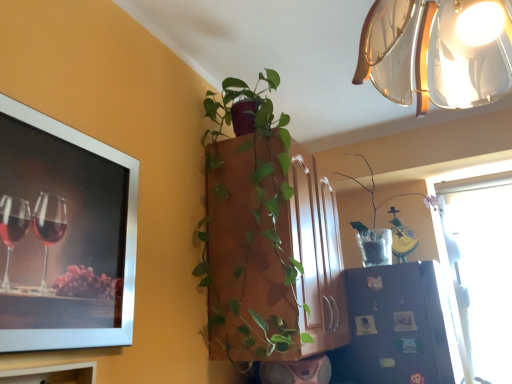
Describe the element at coordinates (387, 215) in the screenshot. The image size is (512, 384). I see `translucent glass vase at upper right, which is counted as the first houseplant, starting from the back` at that location.

What do you see at coordinates (437, 52) in the screenshot?
I see `translucent glass lampshade at upper right` at bounding box center [437, 52].

Locate an element on the screen. The width and height of the screenshot is (512, 384). green matte plant at center, positioned as the first houseplant in front-to-back order is located at coordinates (250, 232).

Is silver metallic picture frame at upper left oriented towards translucent glass vase at upper right, which is counted as the second houseplant, starting from the left?

No.

Who is taller, silver metallic picture frame at upper left or translucent glass vase at upper right, which ranks as the first houseplant in right-to-left order?

silver metallic picture frame at upper left.

Choose the correct answer: Is silver metallic picture frame at upper left inside translucent glass vase at upper right, which is counted as the first houseplant, starting from the back, or outside it?

silver metallic picture frame at upper left is outside translucent glass vase at upper right, which is counted as the first houseplant, starting from the back.

In terms of width, does silver metallic picture frame at upper left look wider or thinner when compared to translucent glass vase at upper right, which appears as the second houseplant when viewed from the front?

Considering their sizes, silver metallic picture frame at upper left looks slimmer than translucent glass vase at upper right, which appears as the second houseplant when viewed from the front.

In the scene shown: Visually, is translucent glass vase at upper right, which ranks as the first houseplant in right-to-left order, positioned to the left or to the right of black matte refrigerator at lower right?

From the image, it's evident that translucent glass vase at upper right, which ranks as the first houseplant in right-to-left order, is to the right of black matte refrigerator at lower right.

Consider the image. Is the position of translucent glass vase at upper right, which appears as the second houseplant when viewed from the front, less distant than that of black matte refrigerator at lower right?

No, it is not.

Would you say translucent glass vase at upper right, which is counted as the second houseplant, starting from the left, is inside or outside black matte refrigerator at lower right?

translucent glass vase at upper right, which is counted as the second houseplant, starting from the left, lies outside black matte refrigerator at lower right.

In the scene shown: From the image's perspective, relative to black matte refrigerator at lower right, is translucent glass vase at upper right, which appears as the second houseplant when viewed from the front, above or below?

translucent glass vase at upper right, which appears as the second houseplant when viewed from the front, is above black matte refrigerator at lower right.

Consider the image. Between green matte plant at center, the 1th houseplant when ordered from left to right, and translucent glass lampshade at upper right, which one has smaller size?

translucent glass lampshade at upper right is smaller.

Is green matte plant at center, the 1th houseplant when ordered from left to right, not near translucent glass lampshade at upper right?

No, there isn't a large distance between green matte plant at center, the 1th houseplant when ordered from left to right, and translucent glass lampshade at upper right.

I want to click on lamp that is on the right side of green matte plant at center, acting as the second houseplant starting from the right, so click(437, 52).

Is green matte plant at center, the 1th houseplant when ordered from left to right, behind translucent glass lampshade at upper right?

Yes.

Between black matte refrigerator at lower right and green matte plant at center, the 1th houseplant when ordered from left to right, which one has smaller size?

Smaller between the two is black matte refrigerator at lower right.

Which of these two, black matte refrigerator at lower right or green matte plant at center, placed as the 2th houseplant when sorted from back to front, stands taller?

Standing taller between the two is green matte plant at center, placed as the 2th houseplant when sorted from back to front.

What's the angular difference between black matte refrigerator at lower right and green matte plant at center, positioned as the first houseplant in front-to-back order,'s facing directions?

They differ by 0.671 degrees in their facing directions.

From a real-world perspective, which is physically below, black matte refrigerator at lower right or green matte plant at center, acting as the second houseplant starting from the right?

black matte refrigerator at lower right, from a real-world perspective.

Looking at this image, from the image's perspective, is black matte refrigerator at lower right located above translucent glass vase at upper right, which ranks as the first houseplant in right-to-left order?

No, from the image's perspective, black matte refrigerator at lower right is not on top of translucent glass vase at upper right, which ranks as the first houseplant in right-to-left order.

Consider the image. Which of these two, black matte refrigerator at lower right or translucent glass vase at upper right, which is counted as the first houseplant, starting from the back, stands shorter?

Standing shorter between the two is black matte refrigerator at lower right.

Is black matte refrigerator at lower right positioned with its back to translucent glass vase at upper right, which ranks as the first houseplant in right-to-left order?

No, black matte refrigerator at lower right is not facing the opposite direction of translucent glass vase at upper right, which ranks as the first houseplant in right-to-left order.

From the picture: Is black matte refrigerator at lower right positioned beyond the bounds of translucent glass vase at upper right, which is counted as the second houseplant, starting from the left?

Yes, black matte refrigerator at lower right is not within translucent glass vase at upper right, which is counted as the second houseplant, starting from the left.

Considering the points (475, 28) and (112, 226), which point is in front, point (475, 28) or point (112, 226)?

The point (475, 28) is closer.

Is translucent glass lampshade at upper right facing away from silver metallic picture frame at upper left?

translucent glass lampshade at upper right does not have its back to silver metallic picture frame at upper left.

In the scene shown: From a real-world perspective, is translucent glass lampshade at upper right under silver metallic picture frame at upper left?

No, from a real-world perspective, translucent glass lampshade at upper right is not below silver metallic picture frame at upper left.

From the image's perspective, between translucent glass lampshade at upper right and silver metallic picture frame at upper left, who is located below?

silver metallic picture frame at upper left, from the image's perspective.

I want to click on lamp lying on the right of green matte plant at center, the 1th houseplant when ordered from left to right, so click(x=437, y=52).

Is translucent glass lampshade at upper right oriented towards green matte plant at center, placed as the 2th houseplant when sorted from back to front?

No, translucent glass lampshade at upper right is not oriented towards green matte plant at center, placed as the 2th houseplant when sorted from back to front.

Between translucent glass lampshade at upper right and green matte plant at center, positioned as the first houseplant in front-to-back order, which one has smaller size?

Smaller between the two is translucent glass lampshade at upper right.

Considering the sizes of objects translucent glass lampshade at upper right and green matte plant at center, positioned as the first houseplant in front-to-back order, in the image provided, who is wider, translucent glass lampshade at upper right or green matte plant at center, positioned as the first houseplant in front-to-back order,?

With larger width is translucent glass lampshade at upper right.

In the image, there is a translucent glass vase at upper right, which is counted as the first houseplant, starting from the back. Identify the location of picture frame below it (from the image's perspective). (64, 235).

Find the location of a particular element. Image resolution: width=512 pixels, height=384 pixels. shelf on the left side of translucent glass vase at upper right, which appears as the second houseplant when viewed from the front is located at coordinates (398, 327).

Looking at this image, considering their positions, is silver metallic picture frame at upper left positioned closer to translucent glass vase at upper right, which is counted as the second houseplant, starting from the left, than green matte plant at center, the 1th houseplant when ordered from left to right?

green matte plant at center, the 1th houseplant when ordered from left to right, is closer to translucent glass vase at upper right, which is counted as the second houseplant, starting from the left.

Based on their spatial positions, is green matte plant at center, the 1th houseplant when ordered from left to right, or silver metallic picture frame at upper left further from translucent glass lampshade at upper right?

silver metallic picture frame at upper left lies further to translucent glass lampshade at upper right than the other object.

When comparing their distances from black matte refrigerator at lower right, does green matte plant at center, the 1th houseplant when ordered from left to right, or silver metallic picture frame at upper left seem further?

silver metallic picture frame at upper left lies further to black matte refrigerator at lower right than the other object.

Looking at the image, which one is located further to translucent glass vase at upper right, which is counted as the first houseplant, starting from the back, black matte refrigerator at lower right or silver metallic picture frame at upper left?

silver metallic picture frame at upper left lies further to translucent glass vase at upper right, which is counted as the first houseplant, starting from the back, than the other object.

Based on the photo, which object lies further to the anchor point translucent glass lampshade at upper right, silver metallic picture frame at upper left or green matte plant at center, acting as the second houseplant starting from the right?

Based on the image, silver metallic picture frame at upper left appears to be further to translucent glass lampshade at upper right.

Based on the photo, looking at the image, which one is located further to black matte refrigerator at lower right, translucent glass vase at upper right, which appears as the second houseplant when viewed from the front, or silver metallic picture frame at upper left?

silver metallic picture frame at upper left is further to black matte refrigerator at lower right.

From the image, which object appears to be farther from silver metallic picture frame at upper left, translucent glass lampshade at upper right or translucent glass vase at upper right, which appears as the second houseplant when viewed from the front?

translucent glass vase at upper right, which appears as the second houseplant when viewed from the front.

Considering their positions, is translucent glass vase at upper right, which is counted as the second houseplant, starting from the left, positioned closer to silver metallic picture frame at upper left than translucent glass lampshade at upper right?

translucent glass lampshade at upper right lies closer to silver metallic picture frame at upper left than the other object.

The width and height of the screenshot is (512, 384). Find the location of `houseplant located between translucent glass lampshade at upper right and translucent glass vase at upper right, which is counted as the second houseplant, starting from the left, in the depth direction`. houseplant located between translucent glass lampshade at upper right and translucent glass vase at upper right, which is counted as the second houseplant, starting from the left, in the depth direction is located at coordinates (250, 232).

The width and height of the screenshot is (512, 384). I want to click on shelf between green matte plant at center, acting as the second houseplant starting from the right, and translucent glass vase at upper right, which appears as the second houseplant when viewed from the front, in the horizontal direction, so click(398, 327).

I want to click on houseplant located between silver metallic picture frame at upper left and black matte refrigerator at lower right in the depth direction, so click(250, 232).

The image size is (512, 384). I want to click on picture frame between translucent glass lampshade at upper right and black matte refrigerator at lower right in the front-back direction, so click(x=64, y=235).